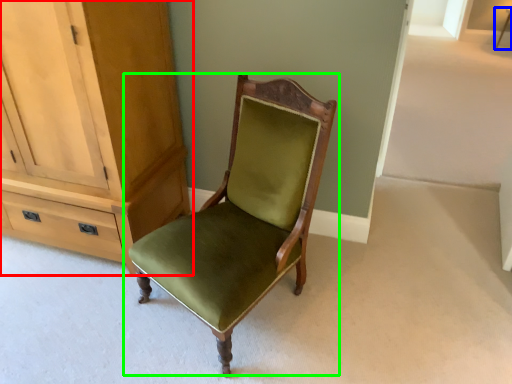
Question: Which object is the closest to the cabinetry (highlighted by a red box)? Choose among these: side table (highlighted by a blue box) or chair (highlighted by a green box).

Choices:
 (A) side table
 (B) chair

Answer: (B)